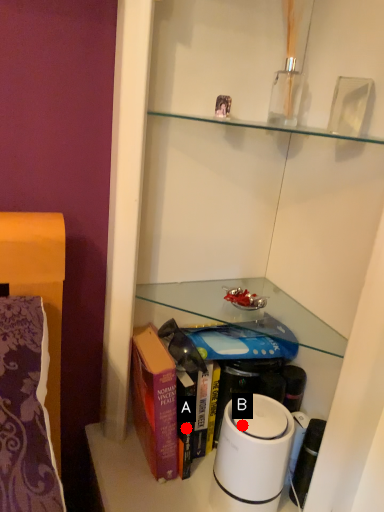
Question: Two points are circled on the image, labeled by A and B beside each circle. Which point is farther from the camera taking this photo?

Choices:
 (A) A is further
 (B) B is further

Answer: (A)